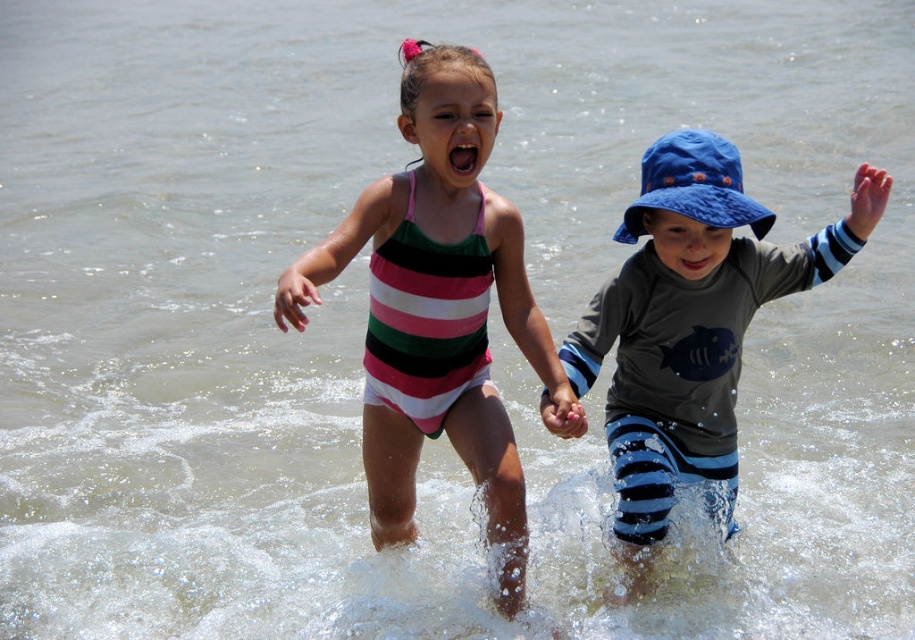
You are a photographer trying to capture a candid shot of the striped fabric swimsuit at center and the blue striped shorts at center. Based on their positions, which one is closer to the camera?

The striped fabric swimsuit at center is located above the blue striped shorts at center, so it is closer to the camera.